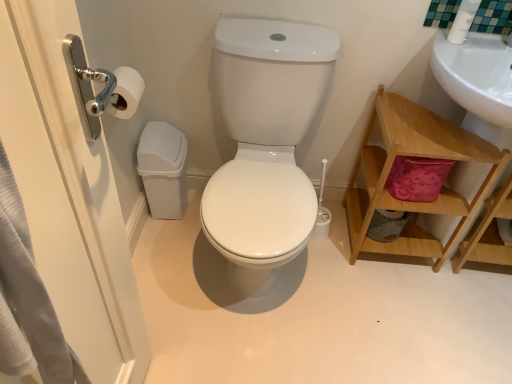
What do you see at coordinates (463, 21) in the screenshot? This screenshot has height=384, width=512. I see `white plastic toilet brush at upper right` at bounding box center [463, 21].

Where is `white glossy toilet at center`? The width and height of the screenshot is (512, 384). white glossy toilet at center is located at coordinates (265, 144).

Identify the location of white plastic toilet brush at upper right. (463, 21).

Which is more to the right, white glossy toilet at center or brushed metal door handle at left?

Positioned to the right is white glossy toilet at center.

Find the location of `screen door that is on the left side of white glossy toilet at center`. screen door that is on the left side of white glossy toilet at center is located at coordinates (68, 194).

Can you tell me how much white glossy toilet at center and brushed metal door handle at left differ in facing direction?

The angle between the facing direction of white glossy toilet at center and the facing direction of brushed metal door handle at left is 87 degrees.

Would you say white glossy toilet at center is outside brushed metal door handle at left?

Absolutely, white glossy toilet at center is external to brushed metal door handle at left.

Is point (269, 257) behind point (463, 32)?

That is False.

From a real-world perspective, between white glossy toilet at center and white plastic toilet brush at upper right, who is vertically higher?

From a 3D spatial view, white plastic toilet brush at upper right is above.

In the image, is white glossy toilet at center on the left side or the right side of white plastic toilet brush at upper right?

In the image, white glossy toilet at center appears on the left side of white plastic toilet brush at upper right.

Could white plastic toilet brush at upper right be considered to be inside white glossy toilet at center?

No, white plastic toilet brush at upper right is not inside white glossy toilet at center.

Considering the sizes of brushed metal door handle at left and white glossy toilet at center in the image, is brushed metal door handle at left taller or shorter than white glossy toilet at center?

In the image, brushed metal door handle at left appears to be taller than white glossy toilet at center.

Is brushed metal door handle at left inside or outside of white glossy toilet at center?

brushed metal door handle at left is outside white glossy toilet at center.

Can you confirm if brushed metal door handle at left is bigger than white glossy toilet at center?

Incorrect, brushed metal door handle at left is not larger than white glossy toilet at center.

Is brushed metal door handle at left far away from white glossy toilet at center?

No, brushed metal door handle at left is in close proximity to white glossy toilet at center.

From a real-world perspective, is white plastic toilet brush at upper right above or below wooden shelf at right?

From a real-world perspective, white plastic toilet brush at upper right is physically above wooden shelf at right.

Does white plastic toilet brush at upper right have a greater height compared to wooden shelf at right?

In fact, white plastic toilet brush at upper right may be shorter than wooden shelf at right.

From the image's perspective, who appears lower, white plastic toilet brush at upper right or wooden shelf at right?

wooden shelf at right appears lower in the image.

This screenshot has height=384, width=512. I want to click on toiletry above the wooden shelf at right (from a real-world perspective), so coord(463,21).

Does white plastic toilet brush at upper right have a lesser height compared to brushed metal door handle at left?

Yes.

Is there a large distance between white plastic toilet brush at upper right and brushed metal door handle at left?

white plastic toilet brush at upper right is positioned a significant distance from brushed metal door handle at left.

Is white plastic toilet brush at upper right to the left of brushed metal door handle at left from the viewer's perspective?

In fact, white plastic toilet brush at upper right is to the right of brushed metal door handle at left.

Which object is further away from the camera taking this photo, white plastic toilet brush at upper right or brushed metal door handle at left?

white plastic toilet brush at upper right is more distant.

From the image's perspective, relative to white glossy toilet at center, is white plastic toilet brush at upper right above or below?

Based on their image positions, white plastic toilet brush at upper right is located above white glossy toilet at center.

Between white plastic toilet brush at upper right and white glossy toilet at center, which one is positioned in front?

Positioned in front is white glossy toilet at center.

At what (x,y) coordinates should I click in order to perform the action: click on toiletry lying behind the white glossy toilet at center. Please return your answer as a coordinate pair (x, y). This screenshot has height=384, width=512. Looking at the image, I should click on (463, 21).

Does wooden shelf at right have a larger size compared to white plastic toilet brush at upper right?

Yes.

Is wooden shelf at right looking in the opposite direction of white plastic toilet brush at upper right?

wooden shelf at right is not turned away from white plastic toilet brush at upper right.

How many degrees apart are the facing directions of wooden shelf at right and white plastic toilet brush at upper right?

There is a 0.207-degree angle between the facing directions of wooden shelf at right and white plastic toilet brush at upper right.

The height and width of the screenshot is (384, 512). What are the coordinates of `toilet behind the brushed metal door handle at left` in the screenshot? It's located at (265, 144).

Identify the location of toiletry above the white glossy toilet at center (from a real-world perspective). (463, 21).

Looking at the image, which one is located further to white plastic toilet brush at upper right, brushed metal door handle at left or white glossy toilet at center?

brushed metal door handle at left is further to white plastic toilet brush at upper right.

When comparing their distances from white glossy toilet at center, does white plastic toilet brush at upper right or wooden shelf at right seem closer?

wooden shelf at right.

Consider the image. Which object lies nearer to the anchor point brushed metal door handle at left, white glossy toilet at center or white plastic toilet brush at upper right?

white glossy toilet at center lies closer to brushed metal door handle at left than the other object.

When comparing their distances from white glossy toilet at center, does wooden shelf at right or white plastic toilet brush at upper right seem closer?

Among the two, wooden shelf at right is located nearer to white glossy toilet at center.

From the image, which object appears to be farther from wooden shelf at right, white plastic toilet brush at upper right or brushed metal door handle at left?

brushed metal door handle at left is positioned further to the anchor wooden shelf at right.

Considering their positions, is white glossy toilet at center positioned further to brushed metal door handle at left than wooden shelf at right?

Among the two, wooden shelf at right is located further to brushed metal door handle at left.

When comparing their distances from white glossy toilet at center, does white plastic toilet brush at upper right or brushed metal door handle at left seem further?

Based on the image, white plastic toilet brush at upper right appears to be further to white glossy toilet at center.

From the image, which object appears to be nearer to white plastic toilet brush at upper right, brushed metal door handle at left or wooden shelf at right?

wooden shelf at right is closer to white plastic toilet brush at upper right.

In order to click on shelf between white glossy toilet at center and white plastic toilet brush at upper right in this screenshot , I will do `click(417, 156)`.

Image resolution: width=512 pixels, height=384 pixels. What are the coordinates of `shelf situated between brushed metal door handle at left and white plastic toilet brush at upper right from left to right` in the screenshot? It's located at (417, 156).

The height and width of the screenshot is (384, 512). Identify the location of toilet between brushed metal door handle at left and white plastic toilet brush at upper right. (265, 144).

Locate an element on the screen. The height and width of the screenshot is (384, 512). toilet between brushed metal door handle at left and wooden shelf at right along the z-axis is located at coordinates (265, 144).